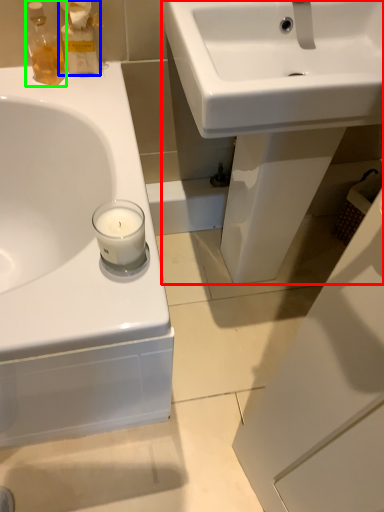
Question: Based on their relative distances, which object is nearer to sink (highlighted by a red box)? Choose from cleaning product (highlighted by a blue box) and toiletry (highlighted by a green box).

Choices:
 (A) cleaning product
 (B) toiletry

Answer: (A)